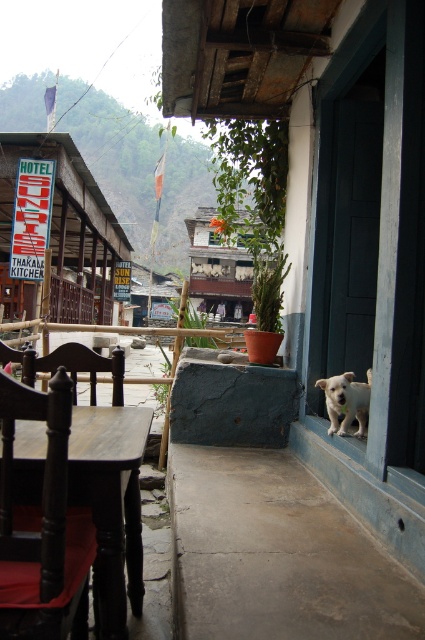
Question: Among these points, which one is farthest from the camera?

Choices:
 (A) (368, 381)
 (B) (260, 225)

Answer: (B)

Question: Where is dark brown wooden table at lower left located in relation to transparent glass window at center in the image?

Choices:
 (A) right
 (B) left

Answer: (B)

Question: Can you confirm if wooden chair at center is wider than white fur dog at lower right?

Choices:
 (A) yes
 (B) no

Answer: (A)

Question: Among these points, which one is nearest to the camera?

Choices:
 (A) [68, 483]
 (B) [45, 356]

Answer: (A)

Question: Which object appears farthest from the camera in this image?

Choices:
 (A) smooth concrete porch at lower center
 (B) transparent glass window at center
 (C) wooden chair at center

Answer: (B)

Question: Does dark brown wooden table at lower left appear under white fur dog at lower right?

Choices:
 (A) yes
 (B) no

Answer: (A)